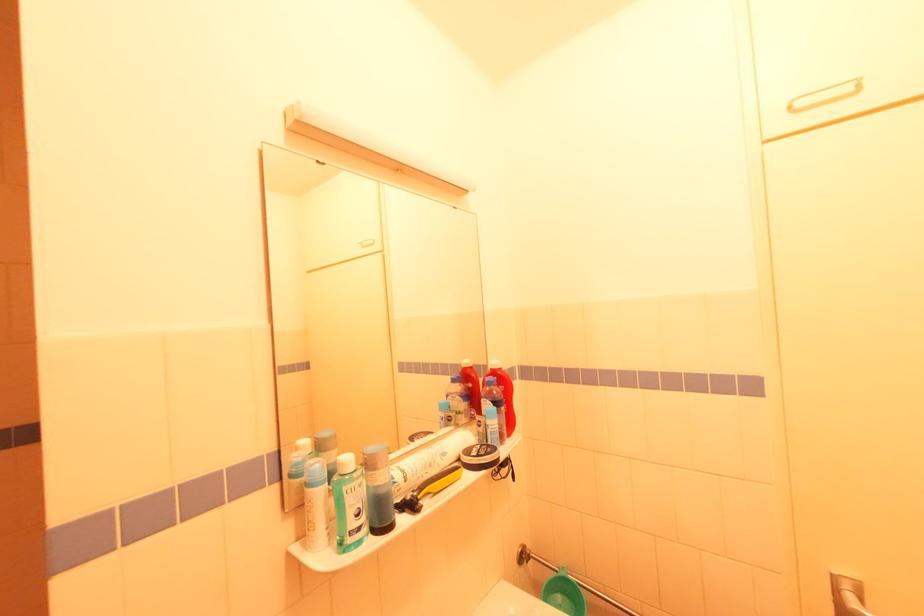
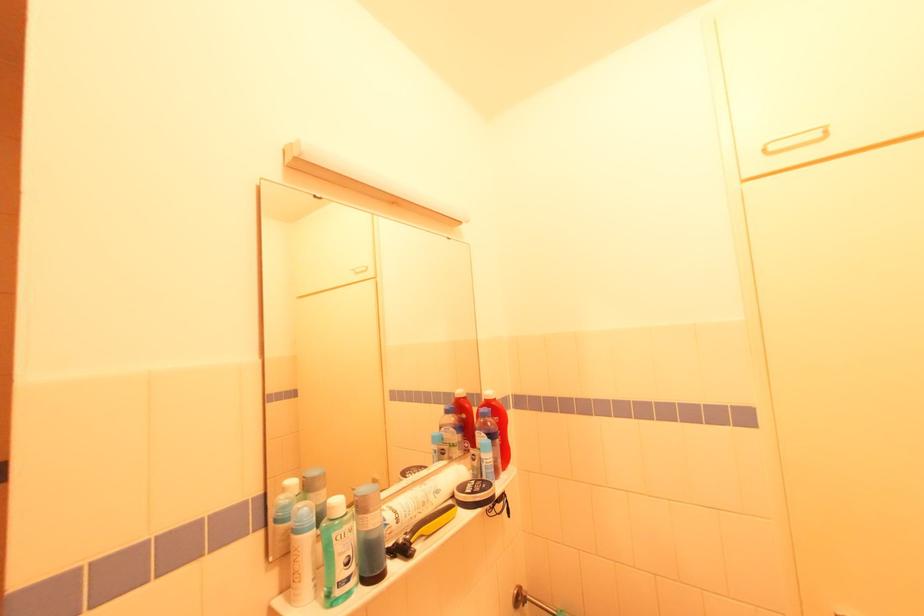
Locate, in the second image, the point that corresponds to [412,507] in the first image.

(406, 552)